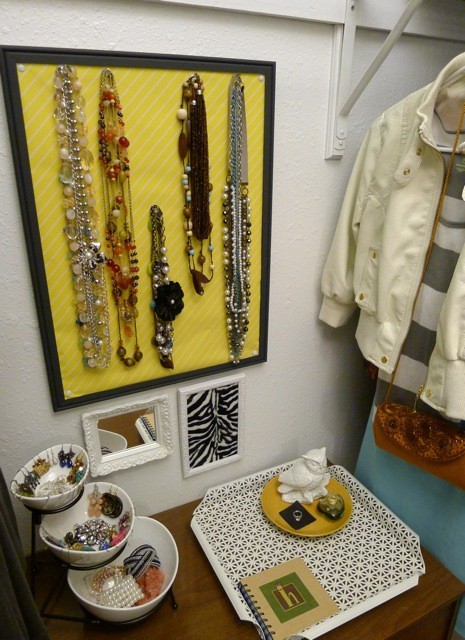
What are the coordinates of `mirror` in the screenshot? It's located at (118, 436).